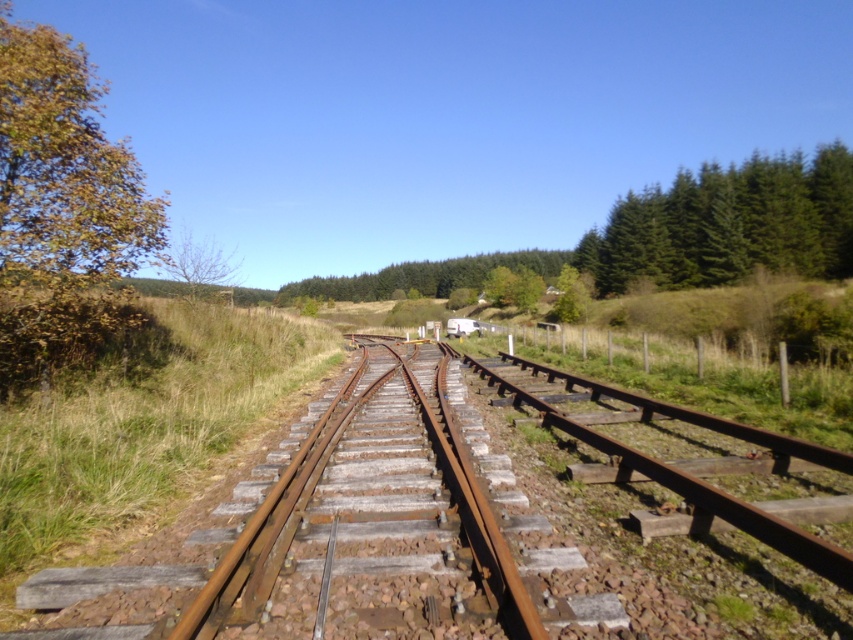
Which is below, rusty metal train track at center or bare branches at left?

rusty metal train track at center is below.

Who is positioned more to the left, rusty metal train track at center or bare branches at left?

bare branches at left is more to the left.

What do you see at coordinates (374, 520) in the screenshot? Image resolution: width=853 pixels, height=640 pixels. I see `rusty metal train track at center` at bounding box center [374, 520].

Identify the location of rusty metal train track at center. This screenshot has width=853, height=640. (374, 520).

Does rusty metal train track at center lie behind green coniferous trees at upper right?

No, it is in front of green coniferous trees at upper right.

You are a GUI agent. You are given a task and a screenshot of the screen. Output one action in this format:
    pyautogui.click(x=<x>, y=<y>)
    Task: Click on the rusty metal train track at center
    
    Given the screenshot: What is the action you would take?
    pyautogui.click(x=374, y=520)

Can you confirm if yellow-green leaves at left is positioned to the right of green coniferous trees at upper right?

In fact, yellow-green leaves at left is to the left of green coniferous trees at upper right.

Does yellow-green leaves at left appear under green coniferous trees at upper right?

Yes.

At what (x,y) coordinates should I click in order to perform the action: click on yellow-green leaves at left. Please return your answer as a coordinate pair (x, y). Looking at the image, I should click on (62, 211).